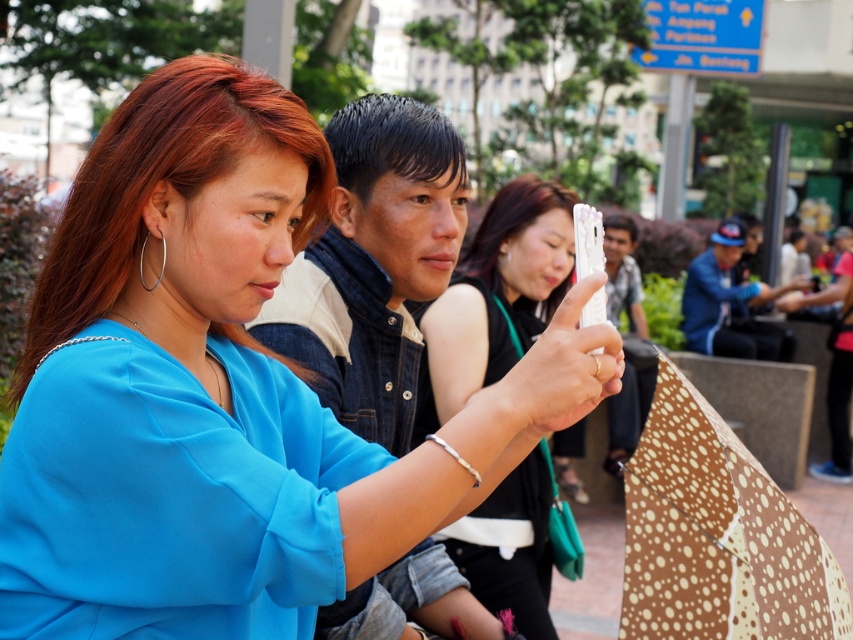
Question: Is matte blue blouse at center further to camera compared to white matte phone at center?

Choices:
 (A) no
 (B) yes

Answer: (A)

Question: Where is matte blue blouse at center located in relation to denim jacket at center in the image?

Choices:
 (A) below
 (B) above

Answer: (A)

Question: Which object is positioned farthest from the blue denim jacket at center?

Choices:
 (A) denim jacket at center
 (B) white matte phone at center
 (C) matte blue blouse at center
 (D) brown dotted fabric umbrella at center

Answer: (D)

Question: Among these points, which one is nearest to the camera?

Choices:
 (A) (473, 380)
 (B) (641, 577)

Answer: (B)

Question: Which point is farther from the camera taking this photo?

Choices:
 (A) (24, 628)
 (B) (776, 337)
 (C) (479, 257)

Answer: (B)

Question: Is matte blue blouse at center to the right of blue denim jacket at center from the viewer's perspective?

Choices:
 (A) yes
 (B) no

Answer: (B)